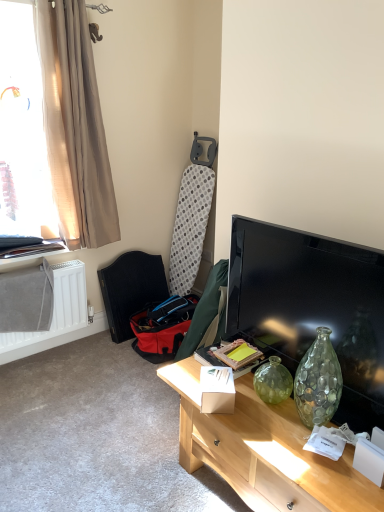
Question: Does light wood desk at center have a lesser width compared to translucent beige curtain at upper left?

Choices:
 (A) no
 (B) yes

Answer: (A)

Question: From a real-world perspective, is light wood desk at center physically above translucent beige curtain at upper left?

Choices:
 (A) yes
 (B) no

Answer: (B)

Question: Considering the relative sizes of light wood desk at center and translucent beige curtain at upper left in the image provided, is light wood desk at center shorter than translucent beige curtain at upper left?

Choices:
 (A) yes
 (B) no

Answer: (A)

Question: Is light wood desk at center turned away from translucent beige curtain at upper left?

Choices:
 (A) yes
 (B) no

Answer: (B)

Question: Is light wood desk at center taller than translucent beige curtain at upper left?

Choices:
 (A) yes
 (B) no

Answer: (B)

Question: Is light wood desk at center not inside translucent beige curtain at upper left?

Choices:
 (A) no
 (B) yes

Answer: (B)

Question: Could you tell me if translucent beige curtain at upper left is facing light wood desk at center?

Choices:
 (A) no
 (B) yes

Answer: (B)

Question: From a real-world perspective, is translucent beige curtain at upper left on light wood desk at center?

Choices:
 (A) yes
 (B) no

Answer: (A)

Question: From the image's perspective, is translucent beige curtain at upper left located above light wood desk at center?

Choices:
 (A) yes
 (B) no

Answer: (A)

Question: From the image's perspective, does translucent beige curtain at upper left appear lower than light wood desk at center?

Choices:
 (A) no
 (B) yes

Answer: (A)

Question: Is light wood desk at center a part of translucent beige curtain at upper left?

Choices:
 (A) no
 (B) yes

Answer: (A)

Question: Considering the relative sizes of translucent beige curtain at upper left and light wood desk at center in the image provided, is translucent beige curtain at upper left wider than light wood desk at center?

Choices:
 (A) no
 (B) yes

Answer: (A)

Question: From a real-world perspective, does matte black tv at right stand above translucent beige curtain at upper left?

Choices:
 (A) yes
 (B) no

Answer: (B)